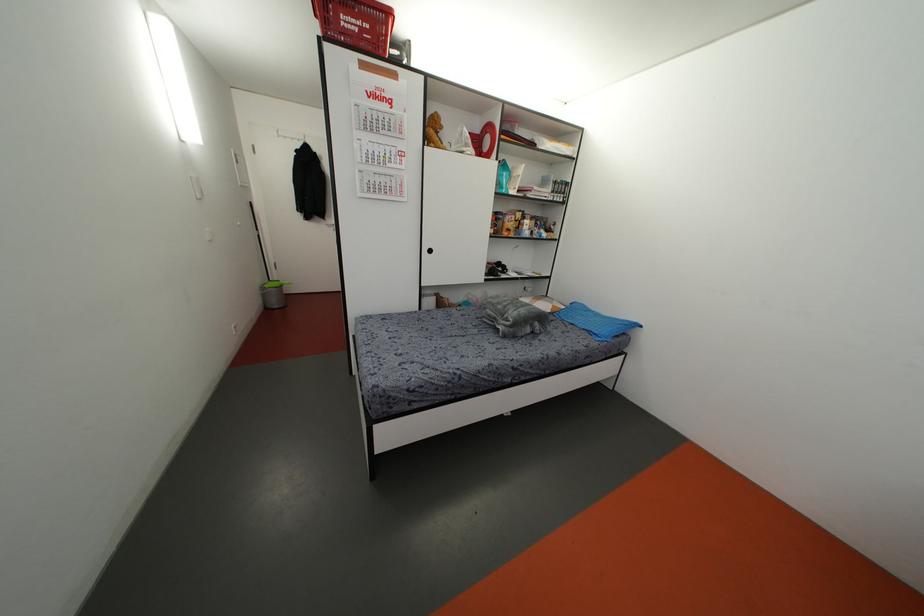
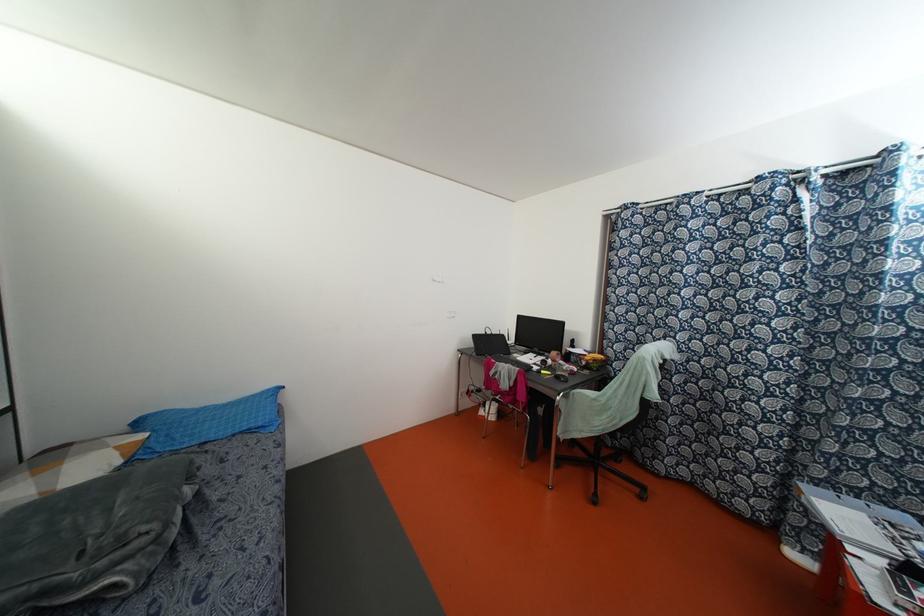
In the second image, find the point that corresponds to point 596,331 in the first image.

(259, 424)